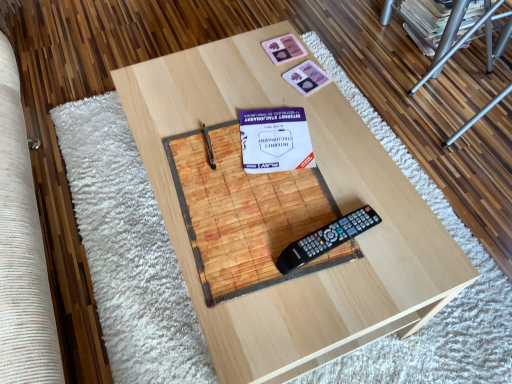
Locate an element on the screen. This screenshot has width=512, height=384. free space to the back side of white paper at center is located at coordinates (262, 92).